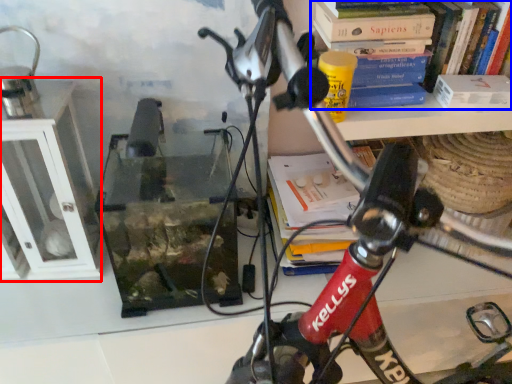
Question: Which object appears closest to the camera in this image, shelf (highlighted by a red box) or book (highlighted by a blue box)?

Choices:
 (A) shelf
 (B) book

Answer: (A)